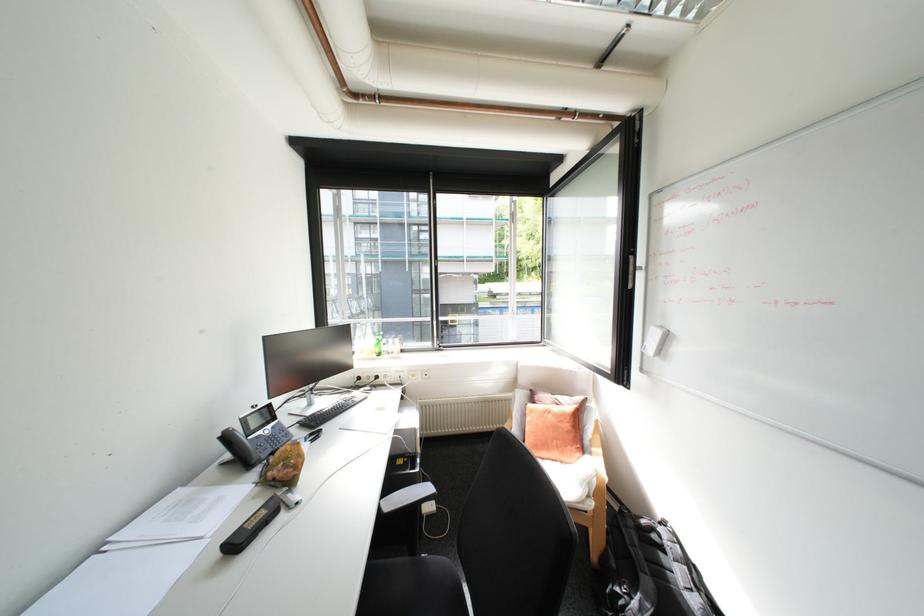
Find where to lift the black phone handset. Please return your answer as a coordinate pair (x, y).

(250, 527)